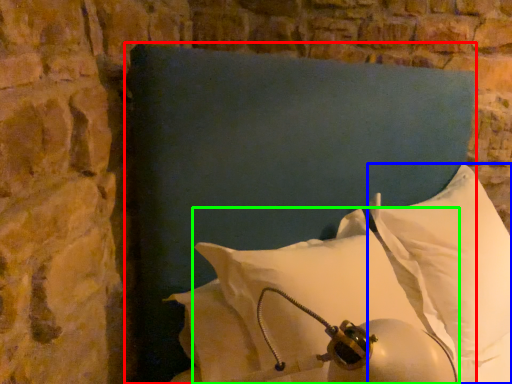
Question: Based on their relative distances, which object is farther from pillow (highlighted by a red box)? Choose from pillow (highlighted by a blue box) and pillow (highlighted by a green box).

Choices:
 (A) pillow
 (B) pillow

Answer: (A)